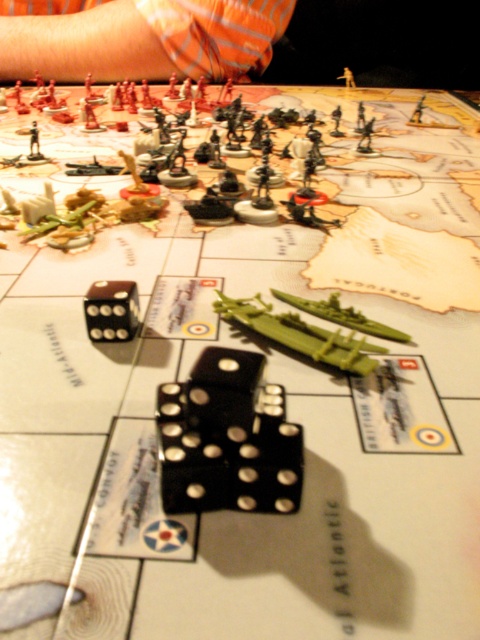
Does orange striped shirt at upper left have a lesser height compared to black rubber dice at center?

In fact, orange striped shirt at upper left may be taller than black rubber dice at center.

Is point (44, 17) closer to viewer compared to point (280, 388)?

No, it is behind (280, 388).

Identify the location of orange striped shirt at upper left. (144, 38).